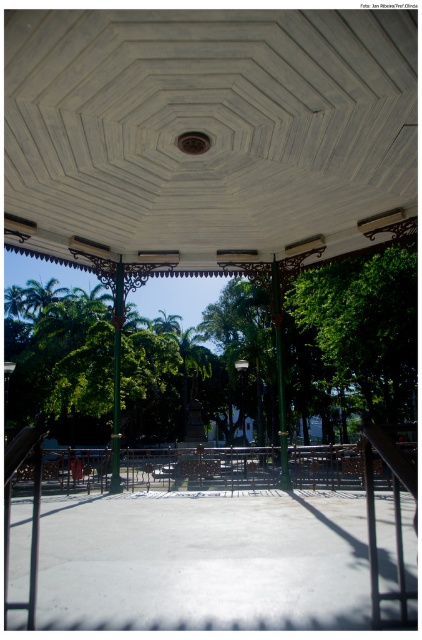
Measure the distance from green leafy tree at center to green leafy tree at right.

6.65 meters

Between green leafy tree at center and green leafy tree at right, which one appears on the right side from the viewer's perspective?

From the viewer's perspective, green leafy tree at right appears more on the right side.

The width and height of the screenshot is (422, 640). What are the coordinates of `green leafy tree at center` in the screenshot? It's located at (354, 337).

Find the location of a particular element. green leafy tree at center is located at coordinates 354,337.